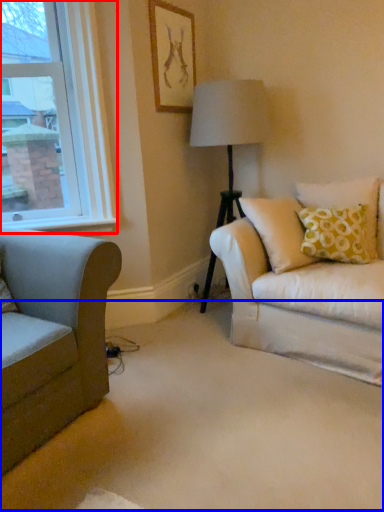
Question: Which object appears farthest to the camera in this image, window (highlighted by a red box) or plain (highlighted by a blue box)?

Choices:
 (A) window
 (B) plain

Answer: (A)